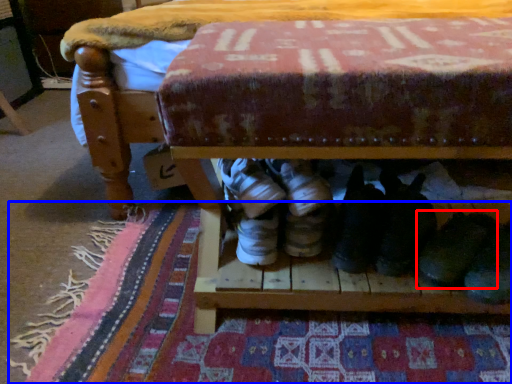
Question: Which object is closer to the camera taking this photo, footwear (highlighted by a red box) or mat (highlighted by a blue box)?

Choices:
 (A) footwear
 (B) mat

Answer: (A)